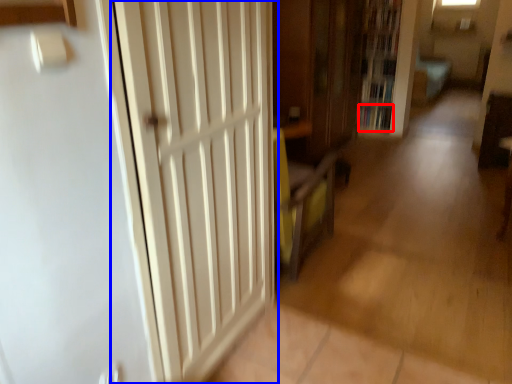
Question: Which object appears closest to the camera in this image, book (highlighted by a red box) or door (highlighted by a blue box)?

Choices:
 (A) book
 (B) door

Answer: (B)